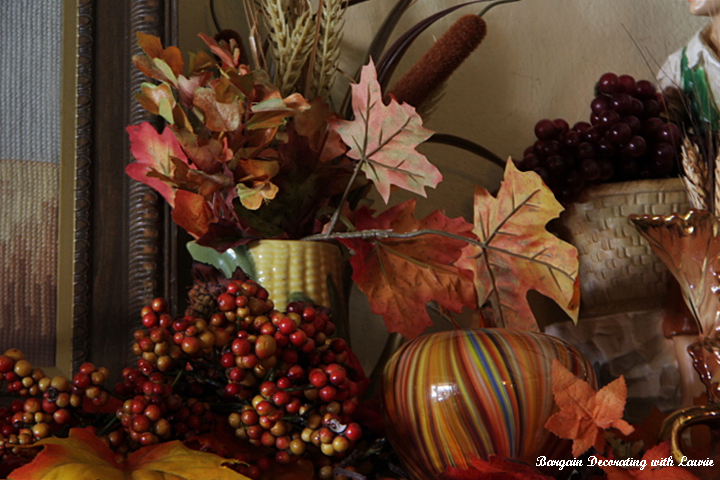
At what (x,y) coordinates should I click in order to perform the action: click on wall. Please return your answer as a coordinate pair (x, y). This screenshot has height=480, width=720. Looking at the image, I should click on (558, 71).